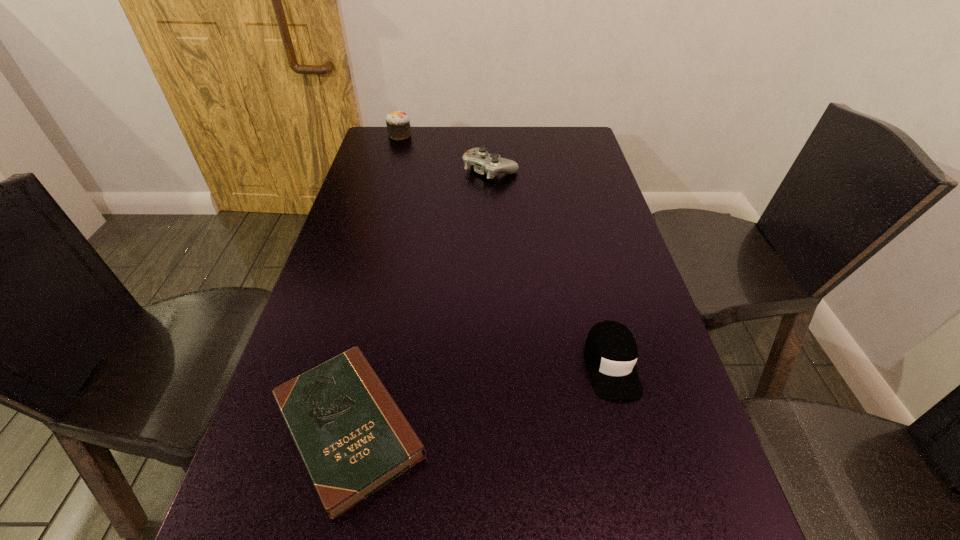
In order to click on vacant region at the far right corner in this screenshot , I will do `click(577, 154)`.

You are a GUI agent. You are given a task and a screenshot of the screen. Output one action in this format:
    pyautogui.click(x=<x>, y=<y>)
    Task: Click on the vacant space in between the second farthest object and the rightmost object
    
    Given the screenshot: What is the action you would take?
    pyautogui.click(x=551, y=267)

Where is `vacant area that lies between the control and the cap`? Image resolution: width=960 pixels, height=540 pixels. vacant area that lies between the control and the cap is located at coordinates (551, 267).

You are a GUI agent. You are given a task and a screenshot of the screen. Output one action in this format:
    pyautogui.click(x=<x>, y=<y>)
    Task: Click on the free spot between the second object from right to left and the cupcake
    
    Given the screenshot: What is the action you would take?
    pyautogui.click(x=445, y=152)

At what (x,y) coordinates should I click in order to perform the action: click on empty space between the cupcake and the shortest object. Please return your answer as a coordinate pair (x, y). The height and width of the screenshot is (540, 960). Looking at the image, I should click on (374, 281).

Locate an element on the screen. vacant area that lies between the shortest object and the control is located at coordinates (420, 298).

Image resolution: width=960 pixels, height=540 pixels. What are the coordinates of `free space between the Bible and the cupcake` in the screenshot? It's located at (374, 281).

This screenshot has width=960, height=540. I want to click on vacant point located between the tallest object and the second farthest object, so click(445, 152).

The height and width of the screenshot is (540, 960). What are the coordinates of `empty location between the second farthest object and the rightmost object` in the screenshot? It's located at (551, 267).

Where is `empty space that is in between the farthest object and the third nearest object`? The width and height of the screenshot is (960, 540). empty space that is in between the farthest object and the third nearest object is located at coordinates (445, 152).